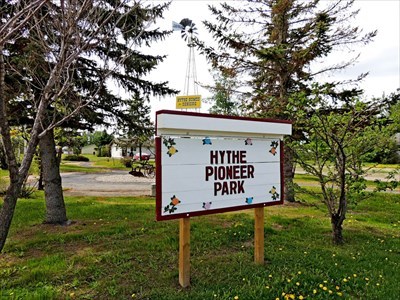
Locate an element on the screen. This screenshot has height=300, width=400. orange flowers is located at coordinates (271, 147), (178, 200).